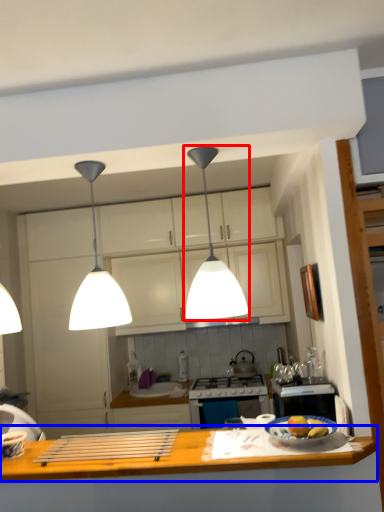
Question: Which point is closer to the camera, light (highlighted by a red box) or countertop (highlighted by a blue box)?

Choices:
 (A) light
 (B) countertop

Answer: (B)